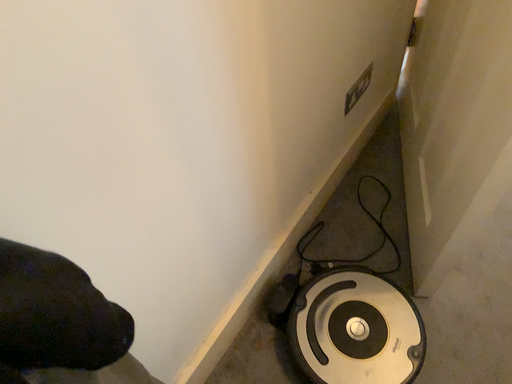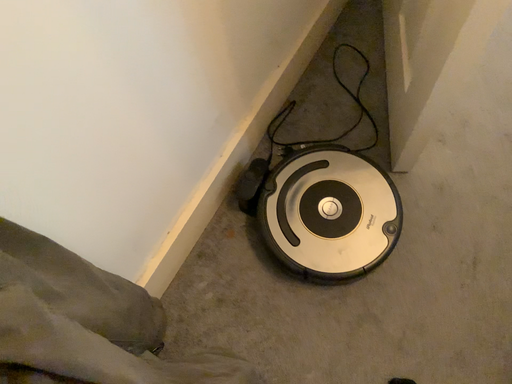
Question: How did the camera likely rotate when shooting the video?

Choices:
 (A) rotated upward
 (B) rotated downward

Answer: (B)